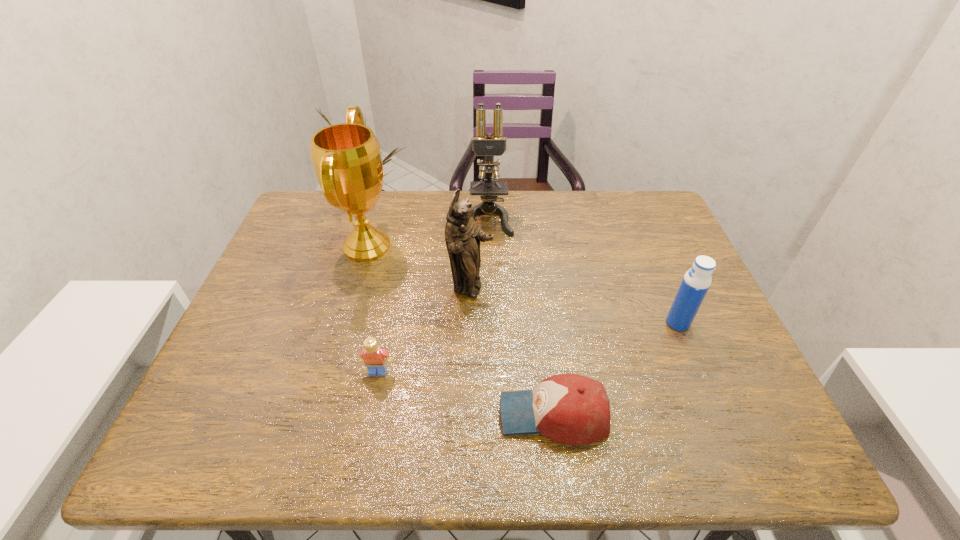
Image resolution: width=960 pixels, height=540 pixels. Find the location of `award`. award is located at coordinates (346, 157).

I want to click on microscope, so click(491, 145).

I want to click on the third tallest object, so click(462, 235).

The image size is (960, 540). In order to click on the fourth farthest object in this screenshot , I will do `click(694, 286)`.

Locate an element on the screen. The height and width of the screenshot is (540, 960). the rightmost object is located at coordinates (694, 286).

Identify the location of Lego. (375, 358).

Locate an element on the screen. The image size is (960, 540). baseball cap is located at coordinates (571, 409).

At what (x,y) coordinates should I click in order to perform the action: click on vacant space situated on the front-facing side of the award. Please return your answer as a coordinate pair (x, y). Looking at the image, I should click on (515, 246).

Find the location of a particular element. vacant area situated 0.170m at the eyepieces of the microscope is located at coordinates coord(490,277).

Identify the location of vacant region located on the front-facing side of the third tallest object. The image size is (960, 540). (550, 288).